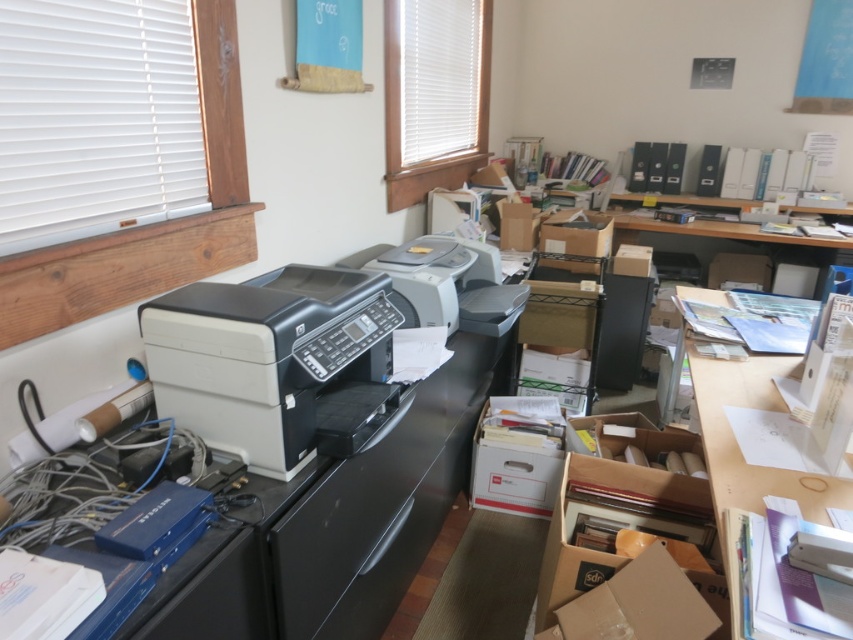
Does black plastic printer at center appear on the left side of white paper at upper right?

Yes, black plastic printer at center is to the left of white paper at upper right.

Between black plastic printer at center and white paper at upper right, which one has less height?

Standing shorter between the two is black plastic printer at center.

Who is more distant from viewer, (370, 413) or (733, 492)?

The point (370, 413) is behind.

In order to click on black plastic printer at center in this screenshot , I will do `click(276, 362)`.

Does black plastic printer at center come behind matte cardboard box at center-right?

No.

Who is more distant from viewer, (x=349, y=276) or (x=566, y=244)?

Positioned behind is point (x=566, y=244).

This screenshot has width=853, height=640. In order to click on black plastic printer at center in this screenshot , I will do `click(276, 362)`.

Who is higher up, white paper at upper right or white matte printer at center?

Positioned higher is white matte printer at center.

Between point (737, 508) and point (486, 272), which one is positioned behind?

Positioned behind is point (486, 272).

Locate an element on the screen. Image resolution: width=853 pixels, height=640 pixels. white paper at upper right is located at coordinates (730, 432).